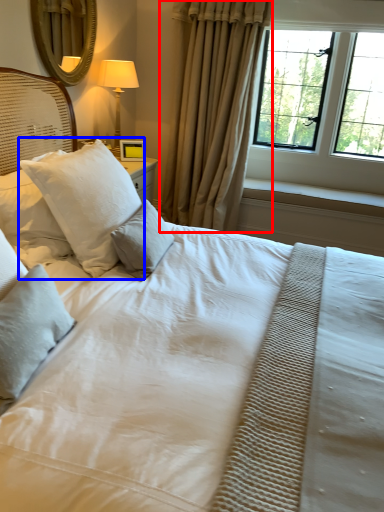
Question: Which of the following is the closest to the observer, curtain (highlighted by a red box) or pillow (highlighted by a blue box)?

Choices:
 (A) curtain
 (B) pillow

Answer: (B)